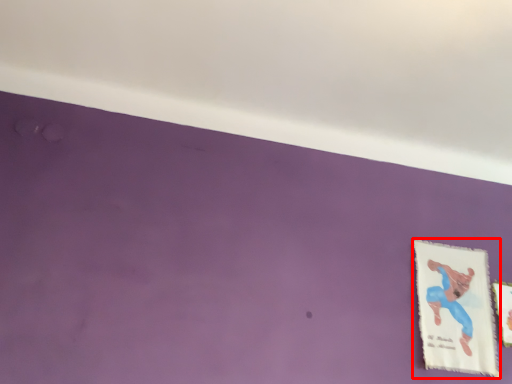
Question: From the image's perspective, where is picture frame (annotated by the red box) located relative to picture frame?

Choices:
 (A) below
 (B) above

Answer: (B)